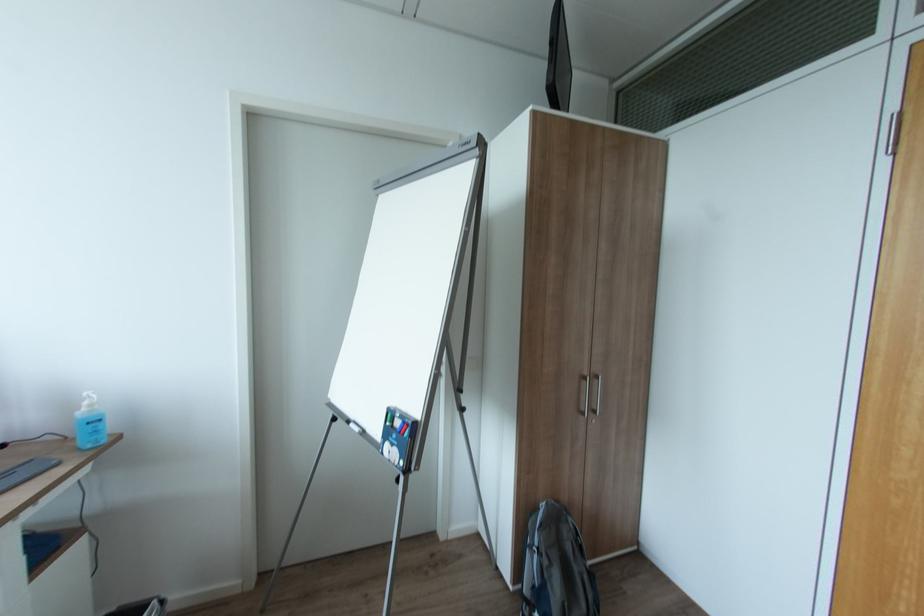
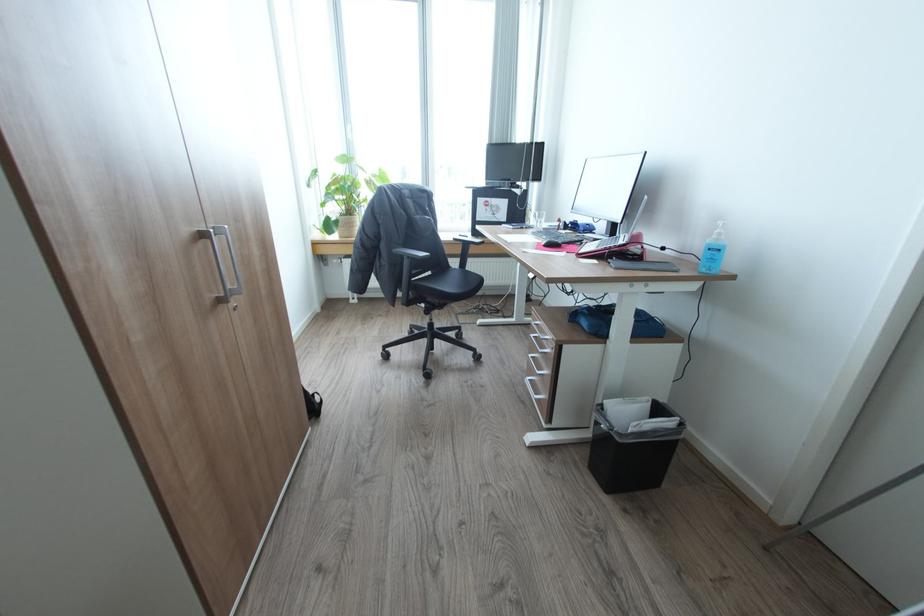
Based on the continuous images, in which direction is the camera rotating?

The rotation direction of the camera is left-down.